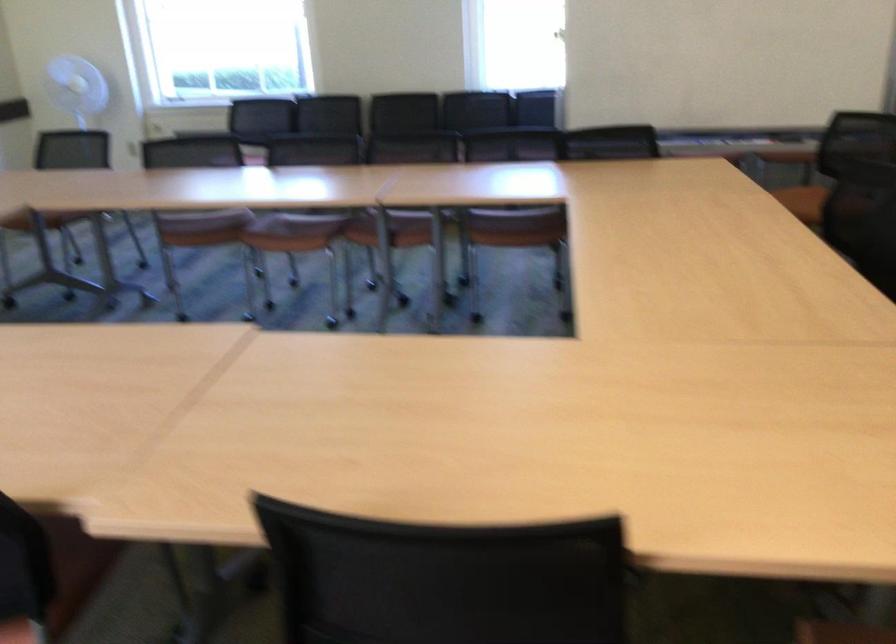
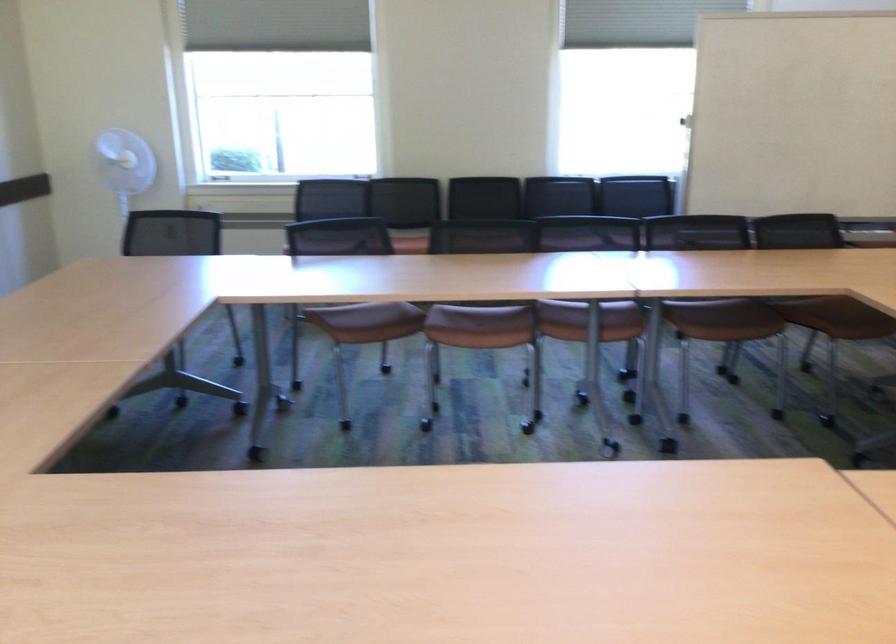
Where in the second image is the point corresponding to pixel 545 200 from the first image?

(820, 295)